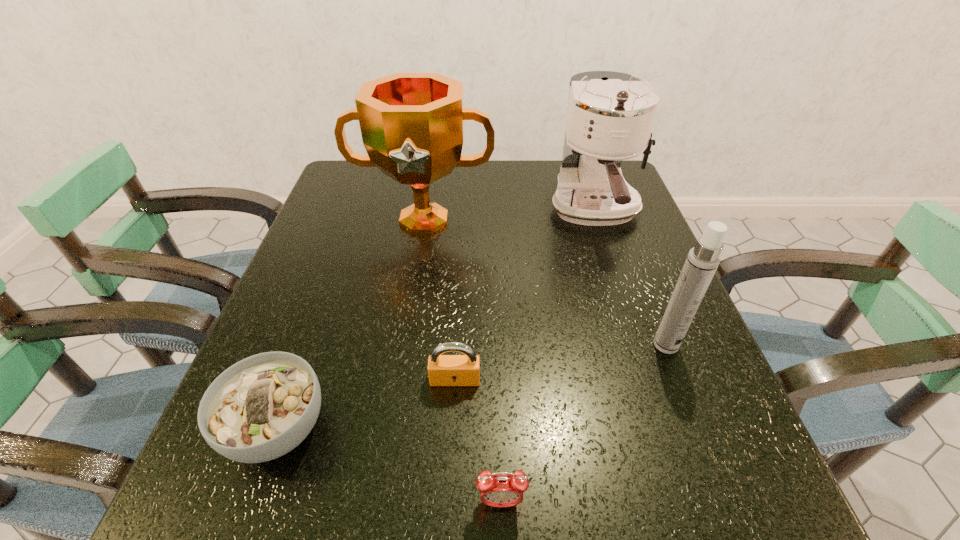
Image resolution: width=960 pixels, height=540 pixels. I want to click on award, so click(x=412, y=124).

The height and width of the screenshot is (540, 960). I want to click on coffee maker, so click(610, 115).

What are the coordinates of `the fourth nearest object` in the screenshot? It's located at (702, 261).

Locate an element on the screen. aerosol can is located at coordinates (702, 261).

Where is `padlock`? padlock is located at coordinates (443, 370).

Identify the location of soup bowl. (262, 407).

Find the location of a particular element. the nearest object is located at coordinates (500, 489).

Locate an element on the screen. Image resolution: width=960 pixels, height=540 pixels. vacant space located on the side of the award with the star emblem is located at coordinates point(410,308).

Locate an element on the screen. free spot located on the front-facing side of the coffee maker is located at coordinates (660, 404).

You are a GUI agent. You are given a task and a screenshot of the screen. Output one action in this format:
    pyautogui.click(x=<x>, y=<y>)
    Task: Click on the vacant area located 0.090m on the front of the aerosol can
    This screenshot has height=540, width=960.
    Given the screenshot: What is the action you would take?
    pyautogui.click(x=686, y=398)